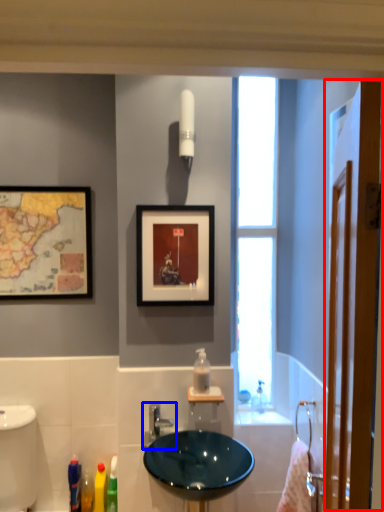
Question: Which object appears closest to the camera in this image, screen door (highlighted by a red box) or tap (highlighted by a blue box)?

Choices:
 (A) screen door
 (B) tap

Answer: (A)